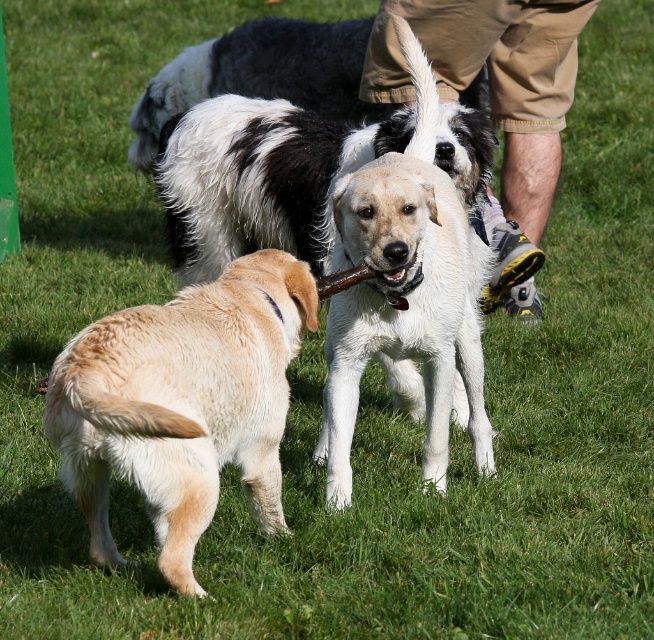
Question: Which object is farther from the camera taking this photo?

Choices:
 (A) white matte dog at center
 (B) golden fur dog at center

Answer: (A)

Question: Does golden fur dog at center appear on the left side of white matte dog at center?

Choices:
 (A) no
 (B) yes

Answer: (B)

Question: Which object is closer to the camera taking this photo?

Choices:
 (A) khaki shorts at center
 (B) golden fur dog at center
 (C) smooth brown bone at center

Answer: (B)

Question: Observing the image, what is the correct spatial positioning of white matte dog at center in reference to smooth brown bone at center?

Choices:
 (A) right
 (B) left

Answer: (A)

Question: Can you confirm if white matte dog at center is positioned to the right of smooth brown bone at center?

Choices:
 (A) no
 (B) yes

Answer: (B)

Question: Which point appears farthest from the camera in this image?

Choices:
 (A) (489, 458)
 (B) (77, 333)

Answer: (B)